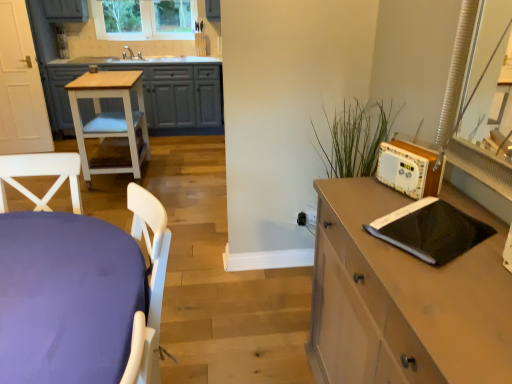
Question: Considering the relative positions of clear glass window at upper center and black matte notebook at right in the image provided, is clear glass window at upper center in front of black matte notebook at right?

Choices:
 (A) no
 (B) yes

Answer: (A)

Question: Can you confirm if clear glass window at upper center is taller than black matte notebook at right?

Choices:
 (A) yes
 (B) no

Answer: (A)

Question: From a real-world perspective, is clear glass window at upper center beneath black matte notebook at right?

Choices:
 (A) yes
 (B) no

Answer: (B)

Question: Considering the relative sizes of clear glass window at upper center and black matte notebook at right in the image provided, is clear glass window at upper center wider than black matte notebook at right?

Choices:
 (A) yes
 (B) no

Answer: (B)

Question: Considering the relative sizes of clear glass window at upper center and black matte notebook at right in the image provided, is clear glass window at upper center shorter than black matte notebook at right?

Choices:
 (A) yes
 (B) no

Answer: (B)

Question: Is black matte notebook at right completely or partially inside clear glass window at upper center?

Choices:
 (A) no
 (B) yes

Answer: (A)

Question: Considering the relative positions of matte brown cabinet at right and light wood/white painted stool at left in the image provided, is matte brown cabinet at right behind light wood/white painted stool at left?

Choices:
 (A) no
 (B) yes

Answer: (A)

Question: Does matte brown cabinet at right have a greater height compared to light wood/white painted stool at left?

Choices:
 (A) no
 (B) yes

Answer: (B)

Question: From a real-world perspective, is matte brown cabinet at right located beneath light wood/white painted stool at left?

Choices:
 (A) yes
 (B) no

Answer: (B)

Question: Is matte brown cabinet at right next to light wood/white painted stool at left and touching it?

Choices:
 (A) yes
 (B) no

Answer: (B)

Question: Does matte brown cabinet at right have a greater width compared to light wood/white painted stool at left?

Choices:
 (A) yes
 (B) no

Answer: (B)

Question: From a real-world perspective, is matte brown cabinet at right positioned over light wood/white painted stool at left based on gravity?

Choices:
 (A) no
 (B) yes

Answer: (B)

Question: From the image's perspective, is wooden radio at right over black matte notebook at right?

Choices:
 (A) no
 (B) yes

Answer: (B)